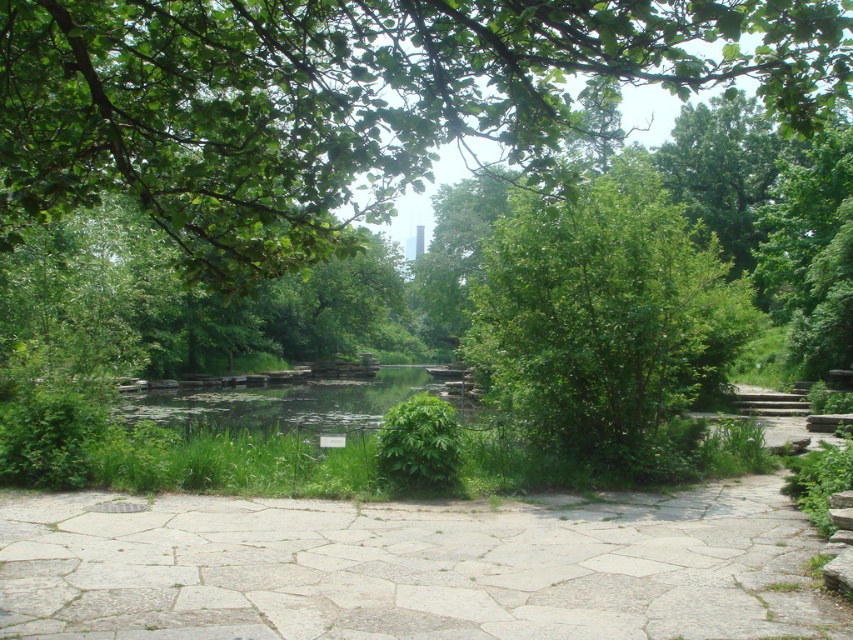
In the scene shown: You are a gardener who needs to water the green leafy bush at center. You are currently standing on the white stone path at center. Which direction should you move to reach the bush?

The white stone path at center is positioned under the green leafy bush at center, so you should move upward from the path to reach the bush.

You are a gardener who needs to mow the white stone path at center and the green leafy bush at center. Which one should you mow first if you want to start with the lower object?

The white stone path at center has a lesser height compared to green leafy bush at center, so you should mow the white stone path at center first.